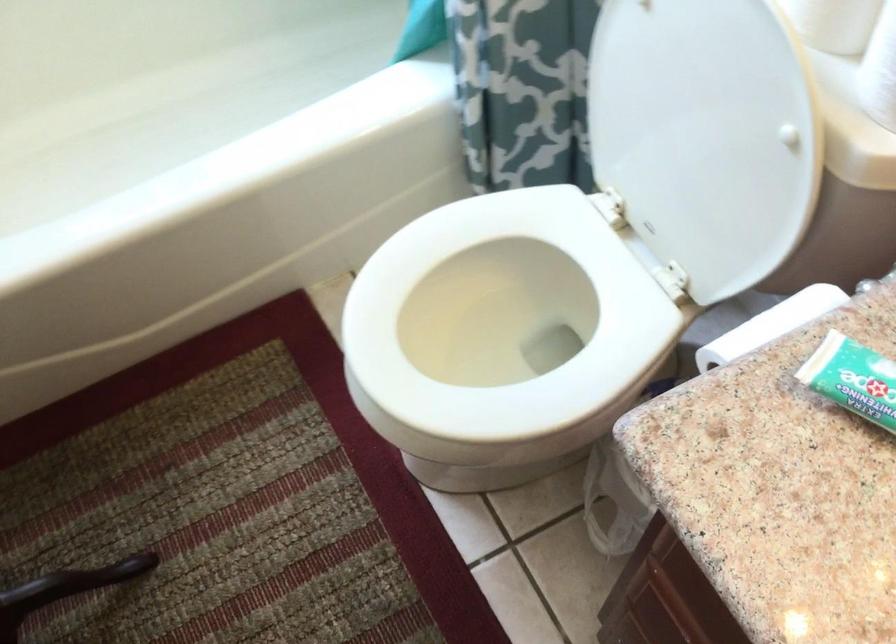
Find where to tear the paper towel roll. Please return your answer as a coordinate pair (x, y).

(880, 70)